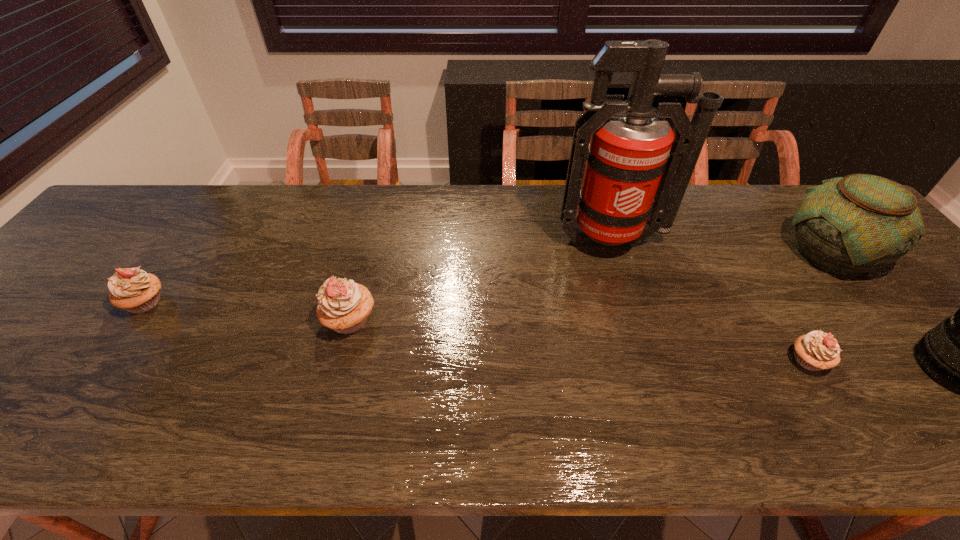
You are a GUI agent. You are given a task and a screenshot of the screen. Output one action in this format:
    pyautogui.click(x=<x>, y=<y>)
    Task: Click on the free space located 0.200m on the right of the tallest cupcake
    
    Given the screenshot: What is the action you would take?
    (x=462, y=321)

This screenshot has width=960, height=540. What are the coordinates of `free space located 0.090m on the back of the fourth object from left to right` in the screenshot? It's located at (780, 314).

Image resolution: width=960 pixels, height=540 pixels. I want to click on vacant space located on the front label side of the fourth object from right to left, so click(x=638, y=323).

In order to click on vacant space located 0.080m on the front of the pottery in this screenshot , I will do `click(881, 313)`.

This screenshot has width=960, height=540. Find the location of `fire extinguisher present at the far edge`. fire extinguisher present at the far edge is located at coordinates (637, 170).

The height and width of the screenshot is (540, 960). Identify the location of pottery that is at the far edge. (850, 225).

Image resolution: width=960 pixels, height=540 pixels. What are the coordinates of `object at the near edge` in the screenshot? It's located at (817, 350).

Locate an element on the screen. object located at the right edge is located at coordinates (850, 225).

Find the location of a particular element. This screenshot has height=540, width=960. object present at the far right corner is located at coordinates (850, 225).

The width and height of the screenshot is (960, 540). Find the location of `vacant space at the far edge of the desktop`. vacant space at the far edge of the desktop is located at coordinates (468, 205).